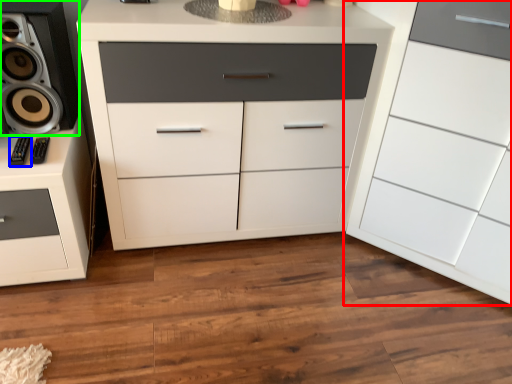
Question: Based on their relative distances, which object is farther from chest of drawers (highlighted by a red box)? Choose from audio (highlighted by a blue box) and speaker (highlighted by a green box).

Choices:
 (A) audio
 (B) speaker

Answer: (A)